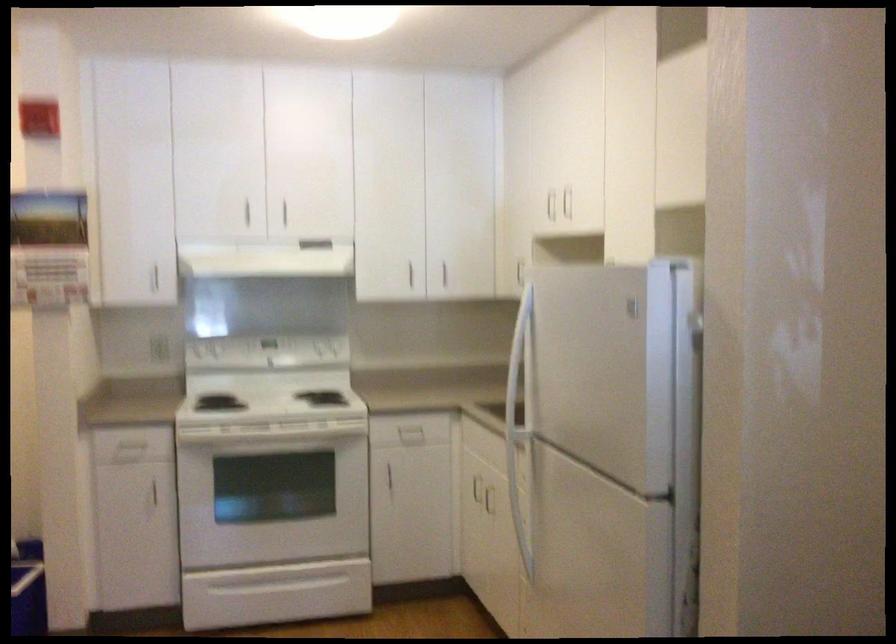
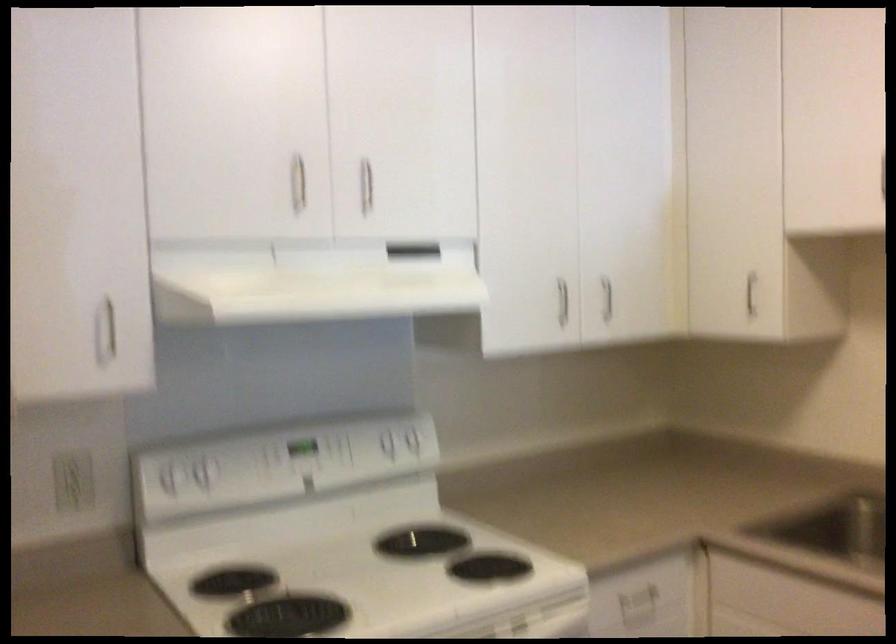
The point at (288, 207) is marked in the first image. Where is the corresponding point in the second image?

(366, 185)